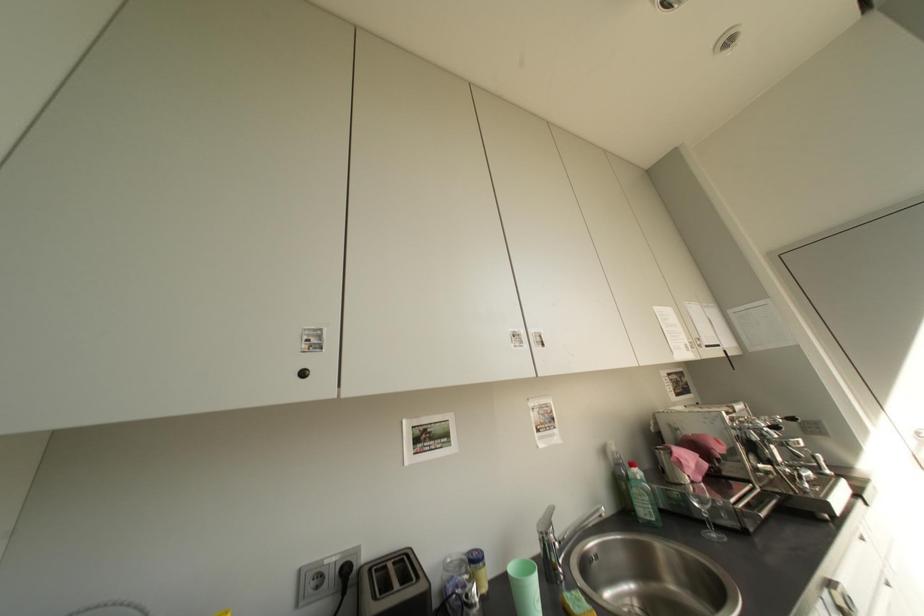
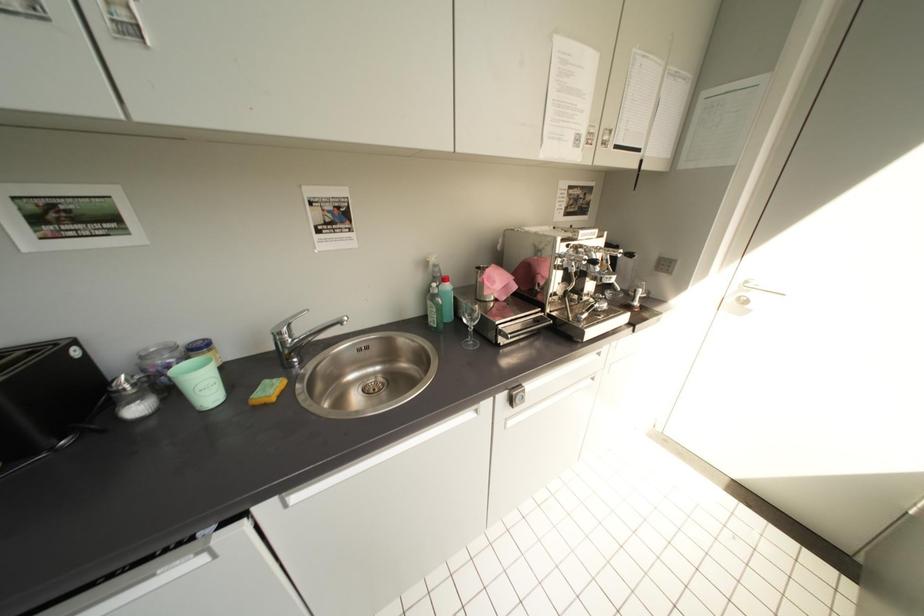
Question: Based on the continuous images, in which direction is the camera rotating? Reply with the corresponding letter.

Choices:
 (A) Left
 (B) Right
 (C) Up
 (D) Down

Answer: (D)